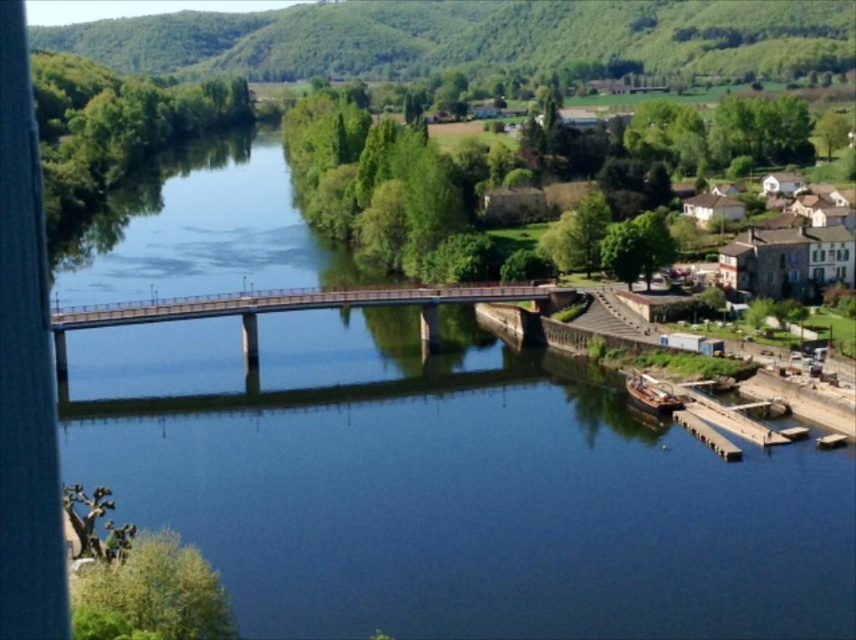
What do you see at coordinates (298, 308) in the screenshot? This screenshot has width=856, height=640. I see `smooth concrete bridge at center` at bounding box center [298, 308].

Is point (432, 301) positioned behind point (789, 268)?

No, (432, 301) is in front of (789, 268).

This screenshot has height=640, width=856. What do you see at coordinates (298, 308) in the screenshot?
I see `smooth concrete bridge at center` at bounding box center [298, 308].

Where is `smooth concrete bridge at center`? The height and width of the screenshot is (640, 856). smooth concrete bridge at center is located at coordinates (298, 308).